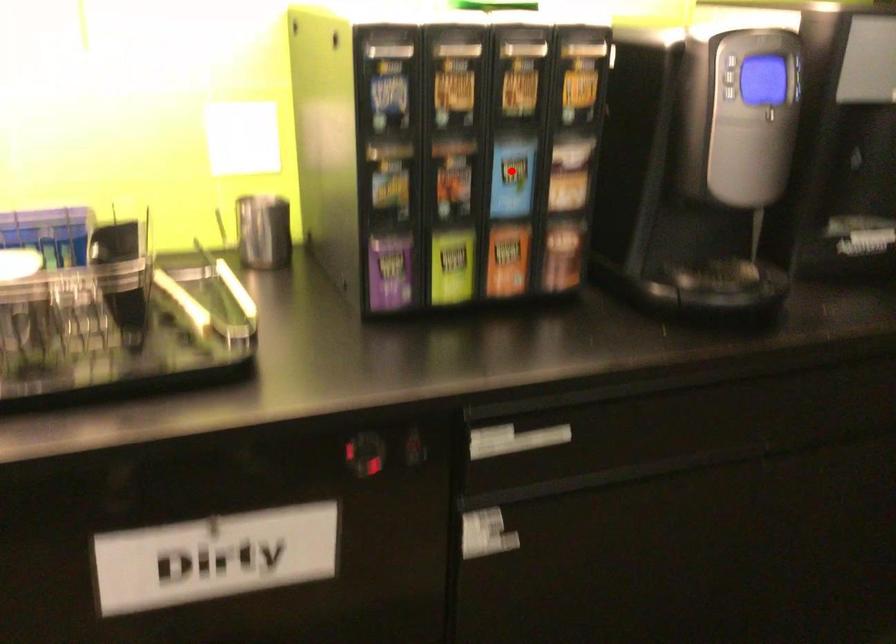
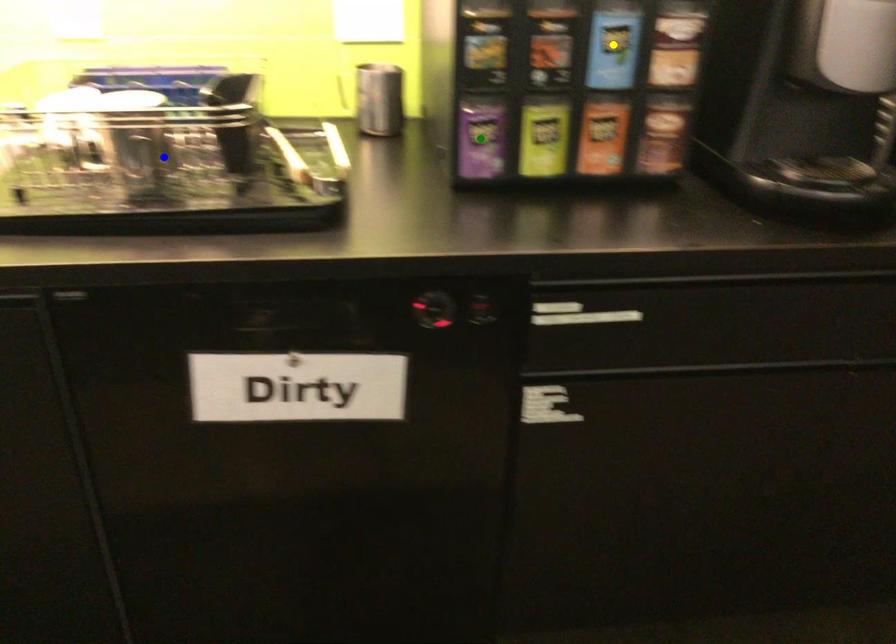
Question: I am providing you with two images of the same scene from different viewpoints. A red point is marked on the first image. You are given multiple points on the second image. In image 2, which mark is for the same physical point as the one in image 1?

Choices:
 (A) blue point
 (B) yellow point
 (C) green point

Answer: (B)